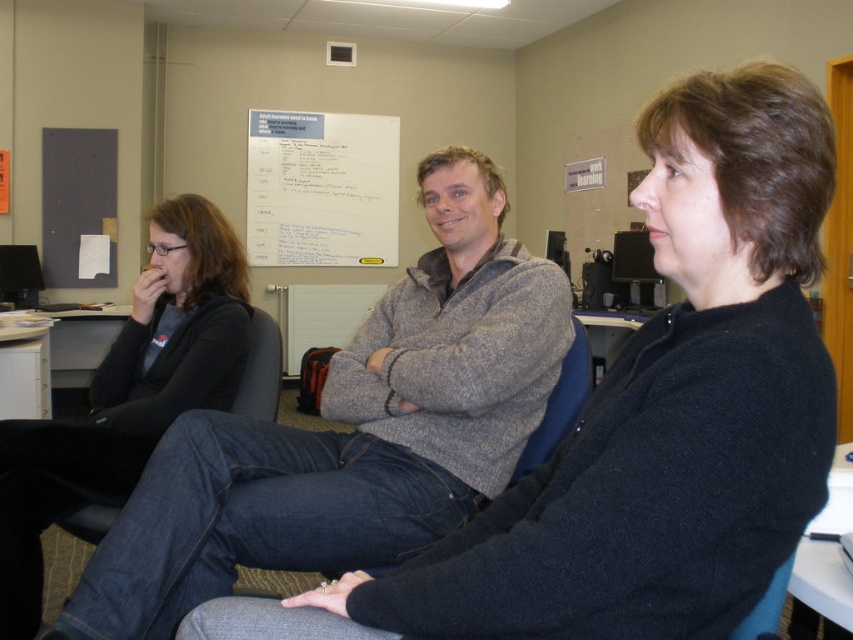
You are organizing a clothing donation drive and need to categorize the sweaters based on their size. Which sweater takes up more space, the dark blue sweater at center or the black sweater at left?

The black sweater at left takes up more space than the dark blue sweater at center because the dark blue sweater at center occupies less space than black sweater at left.

You are organizing a clothing donation drive and need to categorize sweaters by size. You have two sweaters in front of you, the dark blue sweater at center and the black sweater at left. Based on their appearance in the image, which sweater would you classify as the smaller size?

The dark blue sweater at center is shorter than the black sweater at left, so it would be classified as the smaller size.

You are standing at the entrance of the room and want to see both the dark blue sweater at center and the gray sweater at center. Which one will you see first?

The dark blue sweater at center is in front of the gray sweater at center, so you will see the dark blue sweater at center first.